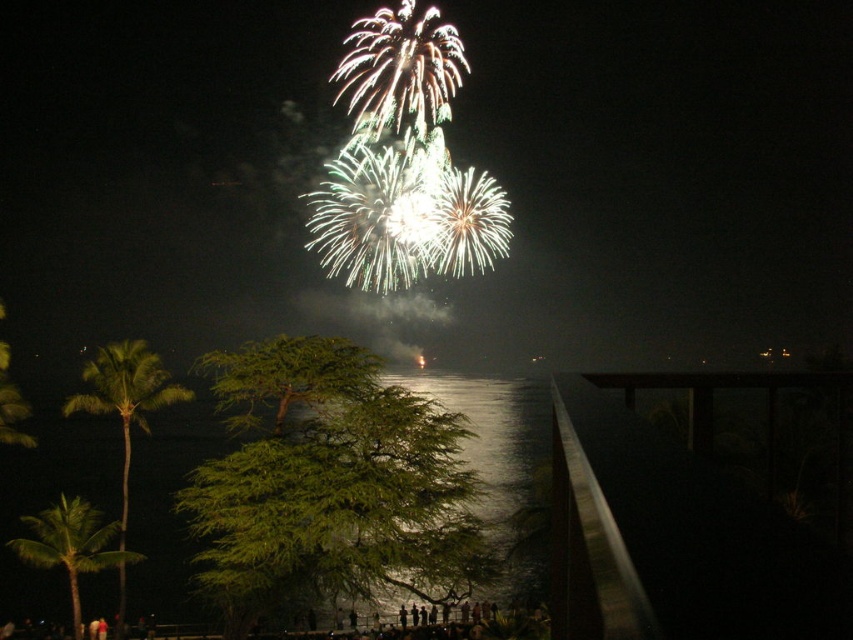
You are a photographer trying to capture the fireworks display. You notice the glistening metallic water at center and the green leafy palm tree at lower left in your viewfinder. Which object appears higher in the image?

The glistening metallic water at center appears higher in the image because it is positioned above the green leafy palm tree at lower left.

You are standing on a pier and want to throw a stone into the glistening metallic water at center. To avoid hitting the green leafy palm tree at lower left, should you aim to the right or left of the tree?

The glistening metallic water at center is to the right of the green leafy palm tree at lower left, so you should aim to the right of the tree to avoid hitting it.

You are a photographer trying to capture the fireworks display. You notice the glistening metallic water at center and the green leafy palm tree at lower left in your frame. Which object will occupy more space in your photo?

The glistening metallic water at center will occupy more space in your photo because it is larger in size than the green leafy palm tree at lower left according to the description.